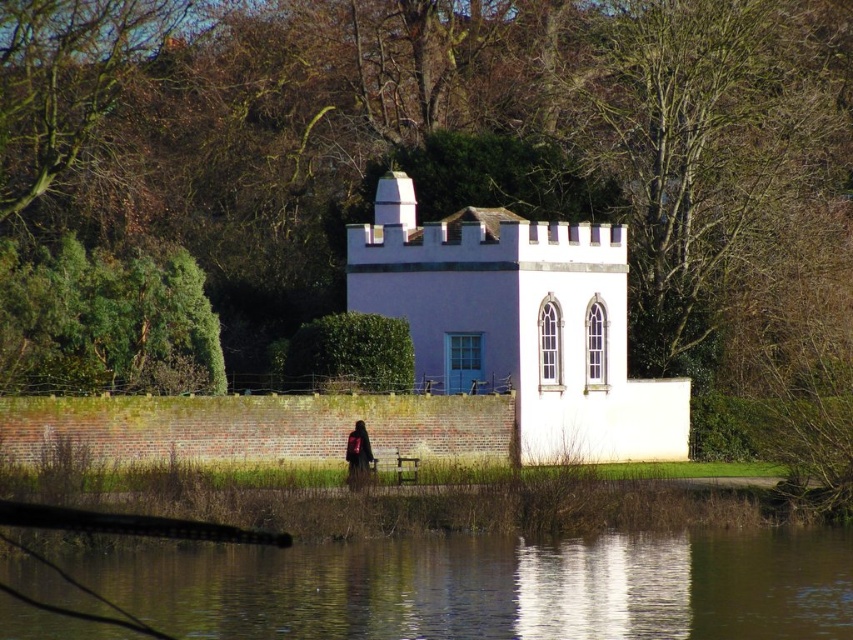
You are standing near the building and want to place your dark brown leather backpack at center on the transparent water at lower center. Is the water deep enough to fully submerge the backpack?

The transparent water at lower center has a lesser height compared to dark brown leather backpack at center, which means the water is not deep enough to fully submerge the backpack.

You are a photographer planning to take a picture of the white smooth chapel at center and the dark brown leather backpack at center. Since you want the chapel to be the main focus, which object should you position closer to the camera to ensure it appears larger in the photo?

To make the white smooth chapel at center appear larger in the photo, you should position it closer to the camera. Since the white smooth chapel at center is much taller than the dark brown leather backpack at center, placing it nearer will emphasize its size relative to the backpack.